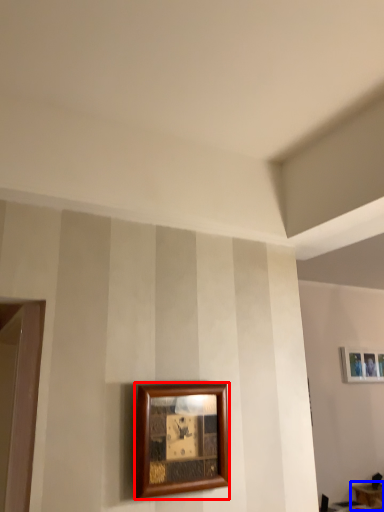
Question: Which point is closer to the camera, picture frame (highlighted by a red box) or table (highlighted by a blue box)?

Choices:
 (A) picture frame
 (B) table

Answer: (A)